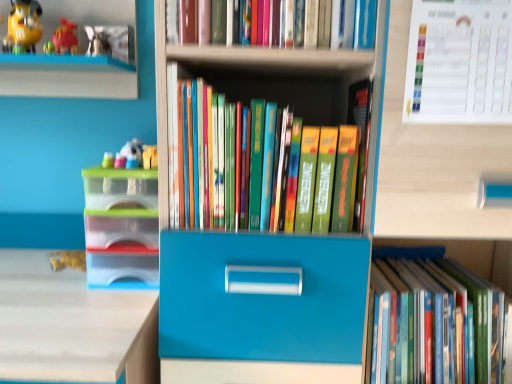
What do you see at coordinates (121, 227) in the screenshot? This screenshot has width=512, height=384. I see `translucent plastic storage box at left` at bounding box center [121, 227].

Where is `hardcover book at lower right, positioned as the 1th book in bottom-to-top order`? This screenshot has height=384, width=512. hardcover book at lower right, positioned as the 1th book in bottom-to-top order is located at coordinates (435, 326).

Describe the element at coordinates (23, 26) in the screenshot. I see `matte yellow toy at upper left, which is counted as the 2th toy, starting from the right` at that location.

At what (x,y) coordinates should I click in order to perform the action: click on hardcover books at upper center, acting as the third book starting from the bottom. Please return your answer as a coordinate pair (x, y). Looking at the image, I should click on (274, 23).

Image resolution: width=512 pixels, height=384 pixels. What do you see at coordinates (459, 62) in the screenshot? I see `white paper calendar at upper right` at bounding box center [459, 62].

The width and height of the screenshot is (512, 384). What are the coordinates of `white paper calendar at upper right` in the screenshot? It's located at click(x=459, y=62).

Locate an element on the screen. hardcover books at center, the 2th book ordered from the bottom is located at coordinates (264, 159).

This screenshot has height=384, width=512. Find the location of `translucent plastic storage box at left`. translucent plastic storage box at left is located at coordinates (121, 227).

From their relative heights in the image, would you say hardcover book at lower right, the third book from the top, is taller or shorter than plastic toy at left, which is the second toy in left-to-right order?

hardcover book at lower right, the third book from the top, is taller than plastic toy at left, which is the second toy in left-to-right order.

Based on their sizes in the image, would you say hardcover book at lower right, positioned as the 1th book in bottom-to-top order, is bigger or smaller than plastic toy at left, which is the second toy in left-to-right order?

hardcover book at lower right, positioned as the 1th book in bottom-to-top order, is bigger than plastic toy at left, which is the second toy in left-to-right order.

Which is in front, hardcover book at lower right, positioned as the 1th book in bottom-to-top order, or plastic toy at left, which appears as the first toy when ordered from the bottom?

hardcover book at lower right, positioned as the 1th book in bottom-to-top order, is in front.

Is white paper calendar at upper right inside translucent plastic storage box at left?

Definitely not — white paper calendar at upper right is not inside translucent plastic storage box at left.

Looking at this image, from the image's perspective, which one is positioned higher, translucent plastic storage box at left or white paper calendar at upper right?

From the image's view, white paper calendar at upper right is above.

Based on the photo, does translucent plastic storage box at left have a greater height compared to white paper calendar at upper right?

Indeed, translucent plastic storage box at left has a greater height compared to white paper calendar at upper right.

Locate an element on the screen. This screenshot has height=384, width=512. storage box that is below the white paper calendar at upper right (from the image's perspective) is located at coordinates (121, 227).

Is point (184, 190) closer or farther from the camera than point (495, 20)?

Point (184, 190) appears to be farther away from the viewer than point (495, 20).

Considering the relative sizes of hardcover books at center, the 2th book ordered from the bottom, and white paper calendar at upper right in the image provided, is hardcover books at center, the 2th book ordered from the bottom, bigger than white paper calendar at upper right?

Yes.

Is hardcover books at center, the 2th book ordered from the bottom, next to white paper calendar at upper right?

hardcover books at center, the 2th book ordered from the bottom, and white paper calendar at upper right are clearly separated.

Could you tell me if hardcover books at center, which ranks as the 2th book in top-to-bottom order, is facing white paper calendar at upper right?

No, hardcover books at center, which ranks as the 2th book in top-to-bottom order, is not facing towards white paper calendar at upper right.

From the picture: Which object is more forward, plastic toy at left, which is the second toy in left-to-right order, or hardcover book at lower right, positioned as the 1th book in bottom-to-top order?

Positioned in front is hardcover book at lower right, positioned as the 1th book in bottom-to-top order.

Looking at the image, does plastic toy at left, marked as the second toy in a top-to-bottom arrangement, seem bigger or smaller compared to hardcover book at lower right, positioned as the 1th book in bottom-to-top order?

In the image, plastic toy at left, marked as the second toy in a top-to-bottom arrangement, appears to be smaller than hardcover book at lower right, positioned as the 1th book in bottom-to-top order.

From the image's perspective, is plastic toy at left, which is the second toy in left-to-right order, located above or below hardcover book at lower right, the third book from the top?

plastic toy at left, which is the second toy in left-to-right order, is situated higher than hardcover book at lower right, the third book from the top, in the image.

From a real-world perspective, which object rests below the other?

hardcover book at lower right, positioned as the 1th book in bottom-to-top order.

Based on the photo, is hardcover books at upper center, acting as the third book starting from the bottom, oriented away from matte yellow toy at upper left, which is counted as the 2th toy, starting from the right?

No, matte yellow toy at upper left, which is counted as the 2th toy, starting from the right, is not at the back of hardcover books at upper center, acting as the third book starting from the bottom.

Which is closer to the camera, [306,26] or [25,7]?

Point [306,26] appears to be closer to the viewer than point [25,7].

From a real-world perspective, is hardcover books at upper center, the 1th book from the top, on top of matte yellow toy at upper left, arranged as the first toy when viewed from the top?

No, from a real-world perspective, hardcover books at upper center, the 1th book from the top, is not on top of matte yellow toy at upper left, arranged as the first toy when viewed from the top.

Which is correct: hardcover books at upper center, the 1th book from the top, is inside matte yellow toy at upper left, which is counted as the 2th toy, starting from the right, or outside of it?

hardcover books at upper center, the 1th book from the top, is located beyond the bounds of matte yellow toy at upper left, which is counted as the 2th toy, starting from the right.

From the image's perspective, which is below, hardcover books at center, which ranks as the 2th book in top-to-bottom order, or plastic toy at left, marked as the second toy in a top-to-bottom arrangement?

hardcover books at center, which ranks as the 2th book in top-to-bottom order, from the image's perspective.

Can you tell me how much hardcover books at center, the 2th book ordered from the bottom, and plastic toy at left, which is the second toy in left-to-right order, differ in facing direction?

The facing directions of hardcover books at center, the 2th book ordered from the bottom, and plastic toy at left, which is the second toy in left-to-right order, are 1.19 degrees apart.

Is hardcover books at center, which ranks as the 2th book in top-to-bottom order, shorter than plastic toy at left, which appears as the first toy when ordered from the bottom?

In fact, hardcover books at center, which ranks as the 2th book in top-to-bottom order, may be taller than plastic toy at left, which appears as the first toy when ordered from the bottom.

Does hardcover books at center, which ranks as the 2th book in top-to-bottom order, turn towards plastic toy at left, marked as the second toy in a top-to-bottom arrangement?

No, hardcover books at center, which ranks as the 2th book in top-to-bottom order, is not oriented towards plastic toy at left, marked as the second toy in a top-to-bottom arrangement.

Where is `book that is the 1st one when counting downward from the white paper calendar at upper right (from the image's perspective)`? book that is the 1st one when counting downward from the white paper calendar at upper right (from the image's perspective) is located at coordinates (264, 159).

How different are the orientations of white paper calendar at upper right and hardcover books at center, the 2th book ordered from the bottom, in degrees?

The facing directions of white paper calendar at upper right and hardcover books at center, the 2th book ordered from the bottom, are 0.00282 degrees apart.

Does white paper calendar at upper right lie behind hardcover books at center, which ranks as the 2th book in top-to-bottom order?

No, it is in front of hardcover books at center, which ranks as the 2th book in top-to-bottom order.

From the image's perspective, does white paper calendar at upper right appear lower than hardcover books at center, which ranks as the 2th book in top-to-bottom order?

Actually, white paper calendar at upper right appears above hardcover books at center, which ranks as the 2th book in top-to-bottom order, in the image.

From a real-world perspective, starting from the hardcover book at lower right, positioned as the 1th book in bottom-to-top order, which toy is the 1st one vertically above it? Please provide its 2D coordinates.

[(132, 153)]

You are a GUI agent. You are given a task and a screenshot of the screen. Output one action in this format:
    pyautogui.click(x=<x>, y=<y>)
    Task: Click on the paperback book lying in front of the translucent plastic storage box at left
    
    Given the screenshot: What is the action you would take?
    pyautogui.click(x=459, y=62)

Considering their positions, is plastic toy at left, marked as the first toy in a right-to-left arrangement, positioned closer to hardcover books at center, the 2th book ordered from the bottom, than translucent plastic storage box at left?

Among the two, translucent plastic storage box at left is located nearer to hardcover books at center, the 2th book ordered from the bottom.

Looking at this image, from the image, which object appears to be farther from hardcover book at lower right, positioned as the 1th book in bottom-to-top order, white paper calendar at upper right or plastic toy at left, which appears as the first toy when ordered from the bottom?

Based on the image, plastic toy at left, which appears as the first toy when ordered from the bottom, appears to be further to hardcover book at lower right, positioned as the 1th book in bottom-to-top order.

Based on their spatial positions, is white paper calendar at upper right or hardcover books at center, the 2th book ordered from the bottom, closer to plastic toy at left, marked as the second toy in a top-to-bottom arrangement?

hardcover books at center, the 2th book ordered from the bottom.

Which object lies further to the anchor point plastic toy at left, which is the second toy in left-to-right order, matte yellow toy at upper left, arranged as the first toy when viewed from the top, or translucent plastic storage box at left?

Based on the image, matte yellow toy at upper left, arranged as the first toy when viewed from the top, appears to be further to plastic toy at left, which is the second toy in left-to-right order.

Considering their positions, is matte yellow toy at upper left, arranged as the first toy when viewed from the top, positioned further to translucent plastic storage box at left than hardcover books at center, which ranks as the 2th book in top-to-bottom order?

Among the two, matte yellow toy at upper left, arranged as the first toy when viewed from the top, is located further to translucent plastic storage box at left.

Estimate the real-world distances between objects in this image. Which object is closer to hardcover books at upper center, acting as the third book starting from the bottom, matte yellow toy at upper left, the 1th toy when ordered from left to right, or translucent plastic storage box at left?

translucent plastic storage box at left lies closer to hardcover books at upper center, acting as the third book starting from the bottom, than the other object.

Considering their positions, is hardcover books at upper center, the 1th book from the top, positioned closer to translucent plastic storage box at left than matte yellow toy at upper left, which is counted as the 2th toy, starting from the right?

The object closer to translucent plastic storage box at left is hardcover books at upper center, the 1th book from the top.

Which object lies further to the anchor point hardcover books at upper center, the 1th book from the top, white paper calendar at upper right or hardcover books at center, the 2th book ordered from the bottom?

Based on the image, hardcover books at center, the 2th book ordered from the bottom, appears to be further to hardcover books at upper center, the 1th book from the top.

Identify the location of toy located between matte yellow toy at upper left, which is counted as the 2th toy, starting from the right, and hardcover book at lower right, the third book from the top, in the left-right direction. Image resolution: width=512 pixels, height=384 pixels. (132, 153).

Locate an element on the screen. The image size is (512, 384). storage box situated between matte yellow toy at upper left, arranged as the first toy when viewed from the top, and hardcover book at lower right, positioned as the 1th book in bottom-to-top order, from left to right is located at coordinates (121, 227).

Image resolution: width=512 pixels, height=384 pixels. In order to click on toy between matte yellow toy at upper left, arranged as the first toy when viewed from the top, and translucent plastic storage box at left from top to bottom in this screenshot , I will do `click(132, 153)`.

Where is `book situated between matte yellow toy at upper left, arranged as the first toy when viewed from the top, and hardcover books at upper center, the 1th book from the top, from left to right`? book situated between matte yellow toy at upper left, arranged as the first toy when viewed from the top, and hardcover books at upper center, the 1th book from the top, from left to right is located at coordinates (264, 159).